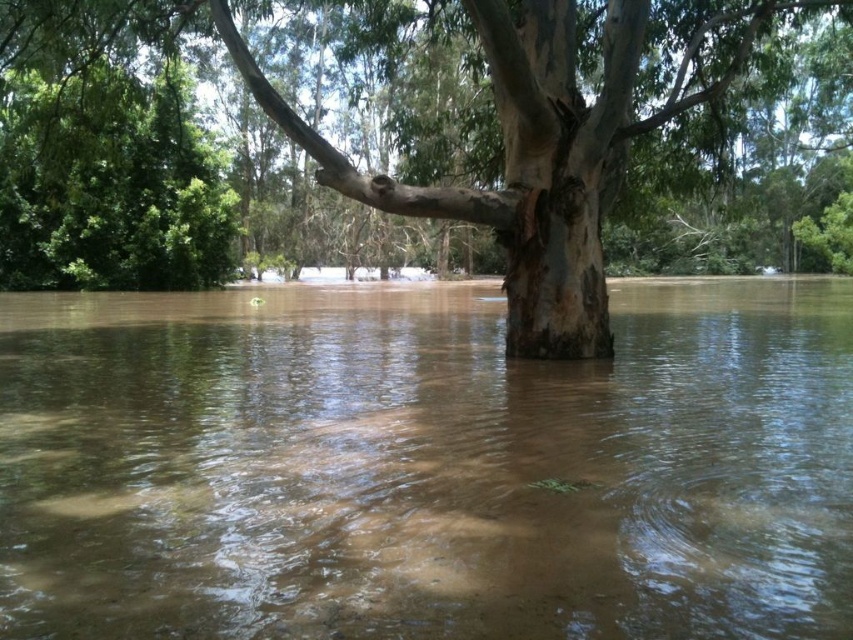
Is brown muddy water at center thinner than brown rough bark tree at center?

No.

Can you confirm if brown muddy water at center is shorter than brown rough bark tree at center?

Yes.

Is point (563, 412) closer to viewer compared to point (508, 164)?

Yes, it is in front of point (508, 164).

Find the location of a particular element. brown muddy water at center is located at coordinates (425, 465).